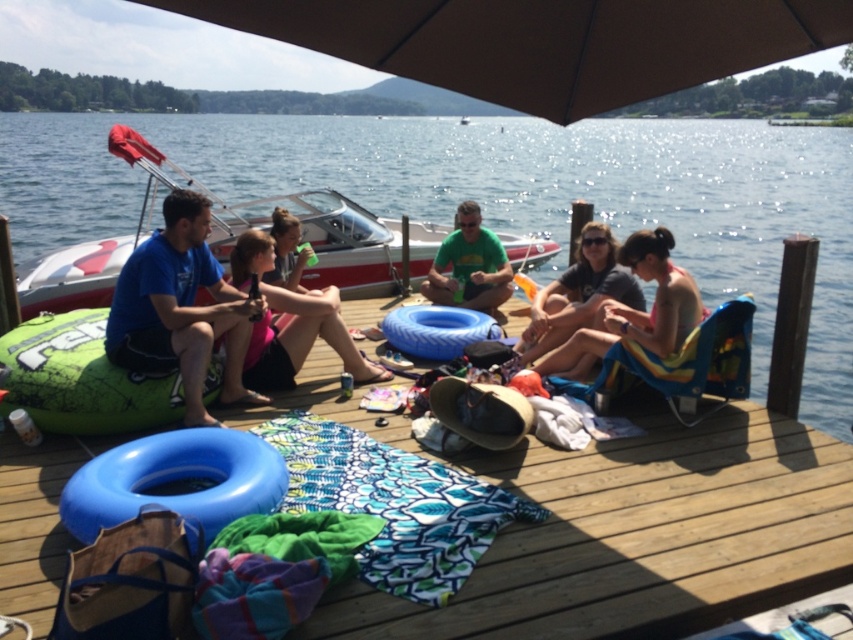
Which of these two, wooden deck at center or matte pink shorts at center, stands taller?

With more height is wooden deck at center.

From the picture: Measure the distance from wooden deck at center to matte pink shorts at center.

8.18 feet

Who is more distant from viewer, (762, 433) or (277, 275)?

Positioned behind is point (277, 275).

The image size is (853, 640). In order to click on wooden deck at center in this screenshot , I will do `click(639, 536)`.

Does brown fabric umbrella at upper center appear over green matte shirt at center?

Yes.

Can you confirm if brown fabric umbrella at upper center is shorter than green matte shirt at center?

Yes, brown fabric umbrella at upper center is shorter than green matte shirt at center.

Image resolution: width=853 pixels, height=640 pixels. Identify the location of brown fabric umbrella at upper center. (543, 42).

Who is taller, blue fabric tube at left or matte pink shorts at center?

blue fabric tube at left

Who is more distant from viewer, (x=112, y=310) or (x=277, y=236)?

Point (x=277, y=236)

Is point (250, 301) closer to viewer compared to point (285, 211)?

Yes, it is.

Where is `blue fabric tube at left`? This screenshot has height=640, width=853. blue fabric tube at left is located at coordinates (181, 308).